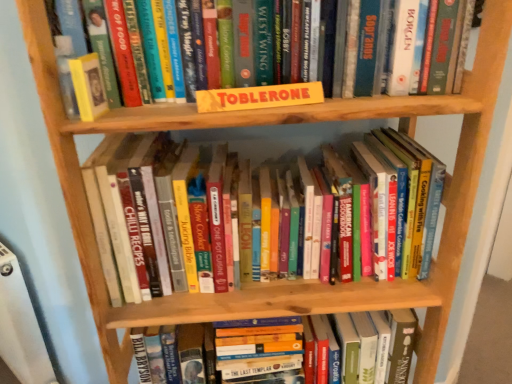
Question: Does yellow cardboard sign at upper center, which ranks as the third book in bottom-to-top order, have a smaller size compared to hardcover book at center, which appears as the 1th book when ordered from the bottom?

Choices:
 (A) yes
 (B) no

Answer: (A)

Question: Is the surface of yellow cardboard sign at upper center, which ranks as the third book in bottom-to-top order, in direct contact with hardcover book at center, which appears as the 1th book when ordered from the bottom?

Choices:
 (A) no
 (B) yes

Answer: (A)

Question: Can we say yellow cardboard sign at upper center, which ranks as the third book in bottom-to-top order, lies outside hardcover book at center, acting as the third book starting from the top?

Choices:
 (A) no
 (B) yes

Answer: (B)

Question: Can you confirm if yellow cardboard sign at upper center, which appears as the 1th book when viewed from the top, is thinner than hardcover book at center, which appears as the 1th book when ordered from the bottom?

Choices:
 (A) yes
 (B) no

Answer: (A)

Question: Is yellow cardboard sign at upper center, which ranks as the third book in bottom-to-top order, positioned with its back to hardcover book at center, acting as the third book starting from the top?

Choices:
 (A) no
 (B) yes

Answer: (A)

Question: From a real-world perspective, is yellow cardboard toblerone at center, the first paperback book when ordered from right to left, positioned above or below yellow cardboard sign at upper center, which ranks as the third book in bottom-to-top order?

Choices:
 (A) above
 (B) below

Answer: (B)

Question: Looking at the image, does yellow cardboard toblerone at center, acting as the second paperback book starting from the left, seem bigger or smaller compared to yellow cardboard sign at upper center, which appears as the 1th book when viewed from the top?

Choices:
 (A) small
 (B) big

Answer: (A)

Question: From their relative heights in the image, would you say yellow cardboard toblerone at center, acting as the second paperback book starting from the left, is taller or shorter than yellow cardboard sign at upper center, which ranks as the third book in bottom-to-top order?

Choices:
 (A) short
 (B) tall

Answer: (A)

Question: Do you think yellow cardboard toblerone at center, the first paperback book when ordered from right to left, is within yellow cardboard sign at upper center, which appears as the 1th book when viewed from the top, or outside of it?

Choices:
 (A) inside
 (B) outside

Answer: (B)

Question: Is point (90, 94) positioned closer to the camera than point (155, 182)?

Choices:
 (A) closer
 (B) farther

Answer: (A)

Question: From a real-world perspective, is hardcover book at upper left, positioned as the first paperback book in left-to-right order, above or below hardcover books at center, which is counted as the 2th book, starting from the top?

Choices:
 (A) above
 (B) below

Answer: (A)

Question: Would you say hardcover book at upper left, marked as the 2th paperback book in a right-to-left arrangement, is to the left or to the right of hardcover books at center, which is the second book from bottom to top, in the picture?

Choices:
 (A) left
 (B) right

Answer: (A)

Question: Relative to hardcover books at center, which is the second book from bottom to top, is hardcover book at upper left, marked as the 2th paperback book in a right-to-left arrangement, in front or behind?

Choices:
 (A) behind
 (B) front

Answer: (B)

Question: Looking at their shapes, would you say hardcover book at center, acting as the third book starting from the top, is wider or thinner than yellow cardboard toblerone at center, acting as the second paperback book starting from the left?

Choices:
 (A) thin
 (B) wide

Answer: (B)

Question: Considering the positions of hardcover book at center, which appears as the 1th book when ordered from the bottom, and yellow cardboard toblerone at center, the first paperback book when ordered from right to left, in the image, is hardcover book at center, which appears as the 1th book when ordered from the bottom, taller or shorter than yellow cardboard toblerone at center, the first paperback book when ordered from right to left,?

Choices:
 (A) short
 (B) tall

Answer: (B)